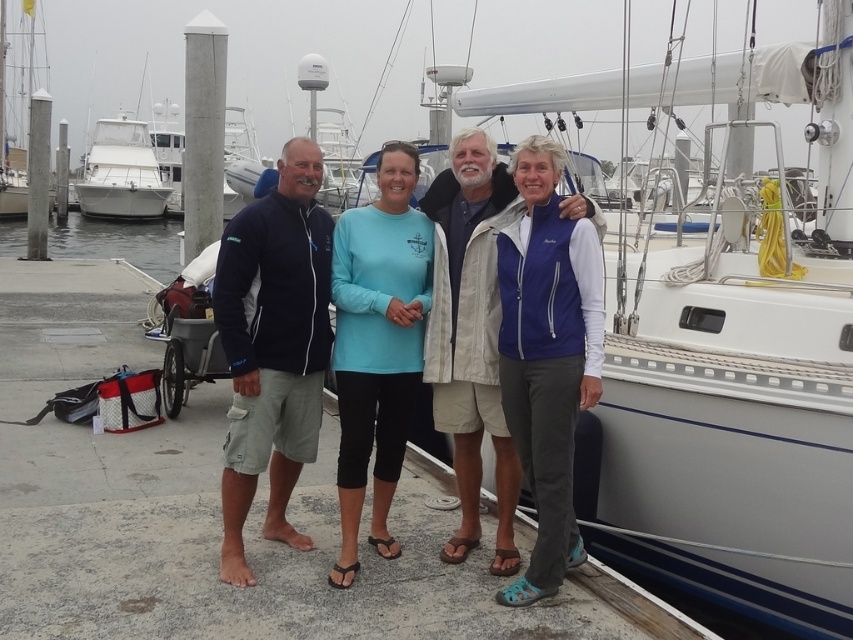
You are a photographer standing at the dock. You want to take a photo of the matte blue jacket at center and the white glossy boat at upper left. Which object is wider?

The white glossy boat at upper left is wider than the matte blue jacket at center.

You are a photographer standing on the dock. You want to take a photo of the matte blue jacket at center and the clear water at dock left. Which object is shorter in height?

The matte blue jacket at center is shorter in height compared to the clear water at dock left.

Which object is located at the coordinates point (467, 269)?

The point (467, 269) corresponds to the matte blue jacket at center.